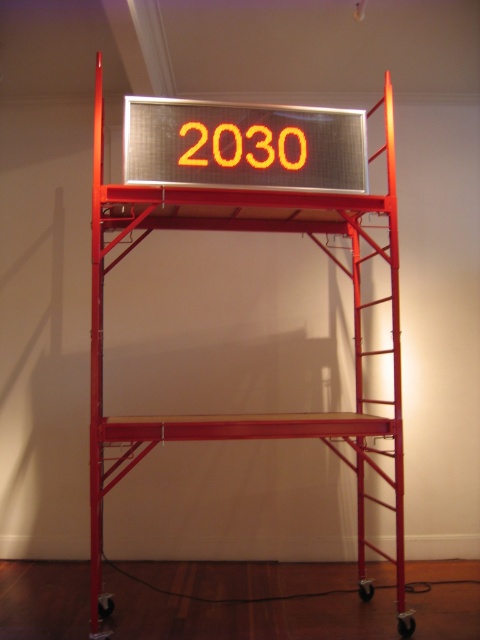
Question: Does metallic red ladder at center appear over orange led digits at center?

Choices:
 (A) yes
 (B) no

Answer: (B)

Question: Among these objects, which one is nearest to the camera?

Choices:
 (A) orange led digits at center
 (B) orange led sign at center

Answer: (B)

Question: Which object appears closest to the camera in this image?

Choices:
 (A) orange led digits at center
 (B) metallic red ladder at center

Answer: (B)

Question: Is orange led sign at center bigger than orange led digits at center?

Choices:
 (A) yes
 (B) no

Answer: (A)

Question: Among these points, which one is farthest from the camera?

Choices:
 (A) (300, 157)
 (B) (179, 179)

Answer: (A)

Question: Can you confirm if orange led sign at center is wider than orange led digits at center?

Choices:
 (A) no
 (B) yes

Answer: (B)